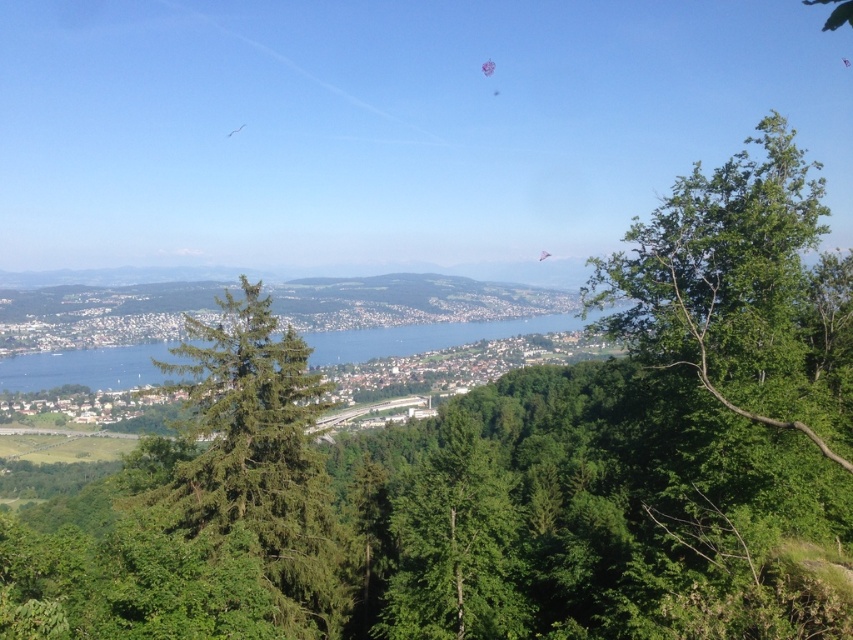
Based on the provided coordinates, can you identify the object located at point (260, 460) in the image?

The object at point (260, 460) is the green needle like tree at center.